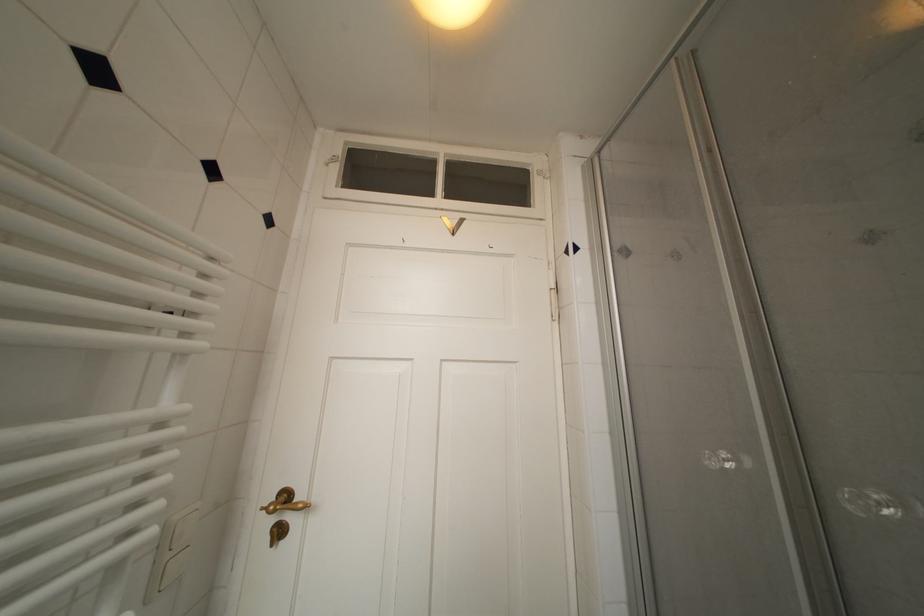
The image size is (924, 616). Describe the element at coordinates (277, 532) in the screenshot. I see `the brass door lock` at that location.